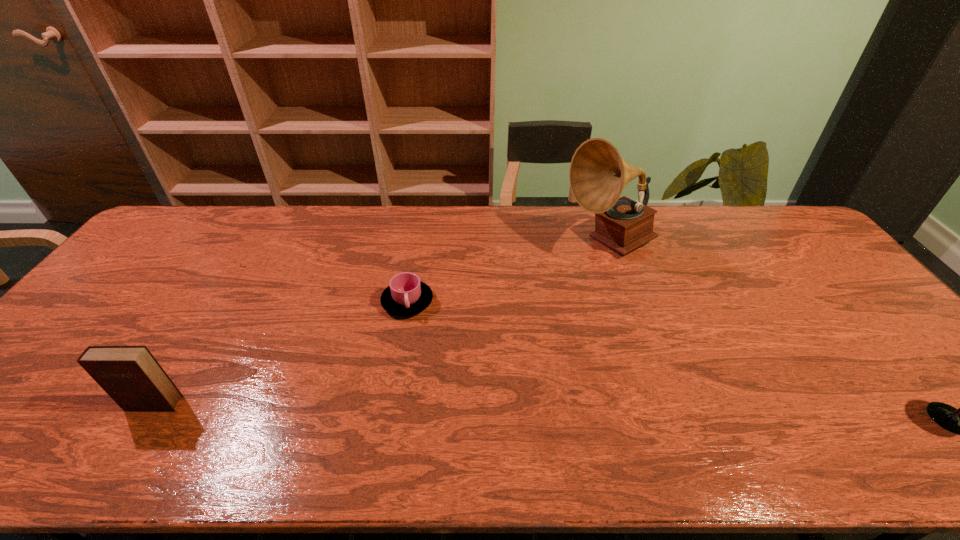
At what (x,y) coordinates should I click in order to perform the action: click on free location located on the horn of the third object from left to right. Please return your answer as a coordinate pair (x, y). Looking at the image, I should click on (588, 274).

In order to click on object present at the far edge in this screenshot , I will do `click(598, 174)`.

Where is `object that is at the near edge`? object that is at the near edge is located at coordinates (130, 375).

At what (x,y) coordinates should I click in order to perform the action: click on vacant space at the far edge of the desktop. Please return your answer as a coordinate pair (x, y). The image size is (960, 540). Looking at the image, I should click on (254, 239).

In the image, there is a desktop. Where is `vacant space at the near edge`? The height and width of the screenshot is (540, 960). vacant space at the near edge is located at coordinates (265, 387).

You are a GUI agent. You are given a task and a screenshot of the screen. Output one action in this format:
    pyautogui.click(x=<x>, y=<y>)
    Task: Click on the free region at the left edge
    
    Given the screenshot: What is the action you would take?
    pyautogui.click(x=136, y=296)

In the image, there is a desktop. Where is `vacant space at the right edge`? The width and height of the screenshot is (960, 540). vacant space at the right edge is located at coordinates (786, 248).

Where is `vacant region between the leftmost object and the tallest object`? vacant region between the leftmost object and the tallest object is located at coordinates (381, 323).

Identify the location of empty space that is in between the phonograph record and the shortest object. (508, 272).

You are a GUI agent. You are given a task and a screenshot of the screen. Output one action in this format:
    pyautogui.click(x=<x>, y=<y>)
    Task: Click on the free space between the second farthest object and the leftmost object
    The image size is (960, 540).
    Given the screenshot: What is the action you would take?
    pyautogui.click(x=280, y=353)